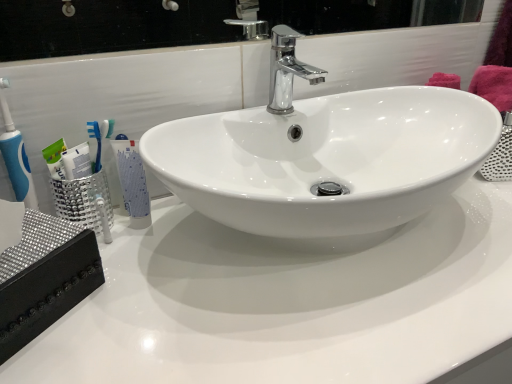
This screenshot has width=512, height=384. Identify the location of chrome/metallic faucet at center. (287, 69).

What are the coordinates of `white glossy tube at left` in the screenshot? It's located at (132, 181).

I want to click on white glossy countertop at center, so click(x=287, y=302).

Considering the positions of points (136, 155) and (343, 329), is point (136, 155) closer to camera compared to point (343, 329)?

That is False.

Are white glossy tube at left and white glossy countertop at center beside each other?

No, white glossy tube at left is not next to white glossy countertop at center.

Is white glossy tube at left facing away from white glossy countertop at center?

No, white glossy countertop at center is not at the back of white glossy tube at left.

Considering the relative positions of white glossy countertop at center and chrome/metallic faucet at center in the image provided, is white glossy countertop at center to the right of chrome/metallic faucet at center from the viewer's perspective?

Correct, you'll find white glossy countertop at center to the right of chrome/metallic faucet at center.

From a real-world perspective, is white glossy countertop at center located higher than chrome/metallic faucet at center?

Incorrect, from a real-world perspective, white glossy countertop at center is lower than chrome/metallic faucet at center.

Choose the correct answer: Is white glossy countertop at center inside chrome/metallic faucet at center or outside it?

white glossy countertop at center is outside chrome/metallic faucet at center.

At what (x,y) coordinates should I click in order to perform the action: click on mouthwash located behind the chrome/metallic faucet at center. Please return your answer as a coordinate pair (x, y). The width and height of the screenshot is (512, 384). Looking at the image, I should click on (132, 181).

Between white glossy tube at left and chrome/metallic faucet at center, which one is positioned in front?

chrome/metallic faucet at center is closer to the camera.

Is white glossy tube at left completely or partially outside of chrome/metallic faucet at center?

Indeed, white glossy tube at left is completely outside chrome/metallic faucet at center.

Is white glossy tube at left not near chrome/metallic faucet at center?

They are positioned close to each other.

Is white glossy countertop at center further to the viewer compared to white glossy tube at left?

That is False.

The width and height of the screenshot is (512, 384). What are the coordinates of `mouthwash on the left of white glossy countertop at center` in the screenshot? It's located at (132, 181).

Could you tell me if white glossy countertop at center is facing white glossy tube at left?

No, white glossy countertop at center is not oriented towards white glossy tube at left.

Looking at this image, is white glossy countertop at center taller or shorter than white glossy tube at left?

Considering their sizes, white glossy countertop at center has more height than white glossy tube at left.

From a real-world perspective, is chrome/metallic faucet at center physically above white glossy tube at left?

Yes.

Is chrome/metallic faucet at center not within white glossy tube at left?

Yes, chrome/metallic faucet at center is not within white glossy tube at left.

Identify the location of tap located on the right of white glossy tube at left. (287, 69).

Is point (281, 51) positioned before point (125, 153)?

No.

Where is `counter top that appears below the chrome/metallic faucet at center (from a real-world perspective)`? This screenshot has height=384, width=512. counter top that appears below the chrome/metallic faucet at center (from a real-world perspective) is located at coordinates (287, 302).

How different are the orientations of chrome/metallic faucet at center and white glossy countertop at center in degrees?

The angle between the facing direction of chrome/metallic faucet at center and the facing direction of white glossy countertop at center is 0.105 degrees.

Is chrome/metallic faucet at center taller or shorter than white glossy countertop at center?

In the image, chrome/metallic faucet at center appears to be shorter than white glossy countertop at center.

From a real-world perspective, between chrome/metallic faucet at center and white glossy countertop at center, who is vertically lower?

In real-world perspective, white glossy countertop at center is lower.

This screenshot has width=512, height=384. What are the coordinates of `counter top that appears in front of the white glossy tube at left` in the screenshot? It's located at (287, 302).

You are a GUI agent. You are given a task and a screenshot of the screen. Output one action in this format:
    pyautogui.click(x=<x>, y=<y>)
    Task: Click on the tap located on the left of white glossy countertop at center
    The height and width of the screenshot is (384, 512).
    Given the screenshot: What is the action you would take?
    pyautogui.click(x=287, y=69)

Considering their positions, is white glossy countertop at center positioned closer to white glossy tube at left than chrome/metallic faucet at center?

white glossy countertop at center is positioned closer to the anchor white glossy tube at left.

When comparing their distances from white glossy countertop at center, does chrome/metallic faucet at center or white glossy tube at left seem further?

chrome/metallic faucet at center lies further to white glossy countertop at center than the other object.

Based on their spatial positions, is white glossy countertop at center or white glossy tube at left further from chrome/metallic faucet at center?

white glossy countertop at center is further to chrome/metallic faucet at center.

Looking at the image, which one is located closer to chrome/metallic faucet at center, white glossy tube at left or white glossy countertop at center?

Among the two, white glossy tube at left is located nearer to chrome/metallic faucet at center.

Based on their spatial positions, is white glossy tube at left or chrome/metallic faucet at center further from white glossy countertop at center?

The object further to white glossy countertop at center is chrome/metallic faucet at center.

Looking at the image, which one is located further to white glossy tube at left, chrome/metallic faucet at center or white glossy countertop at center?

chrome/metallic faucet at center.

Where is `mouthwash between chrome/metallic faucet at center and white glossy countertop at center in the up-down direction`? mouthwash between chrome/metallic faucet at center and white glossy countertop at center in the up-down direction is located at coordinates (132, 181).